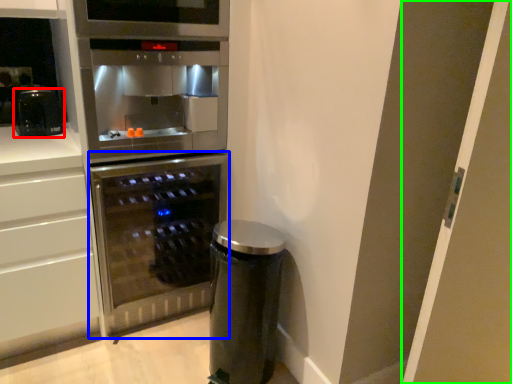
Question: Which is nearer to the kitchen appliance (highlighted by a red box)? home appliance (highlighted by a blue box) or glass door (highlighted by a green box).

Choices:
 (A) home appliance
 (B) glass door

Answer: (A)